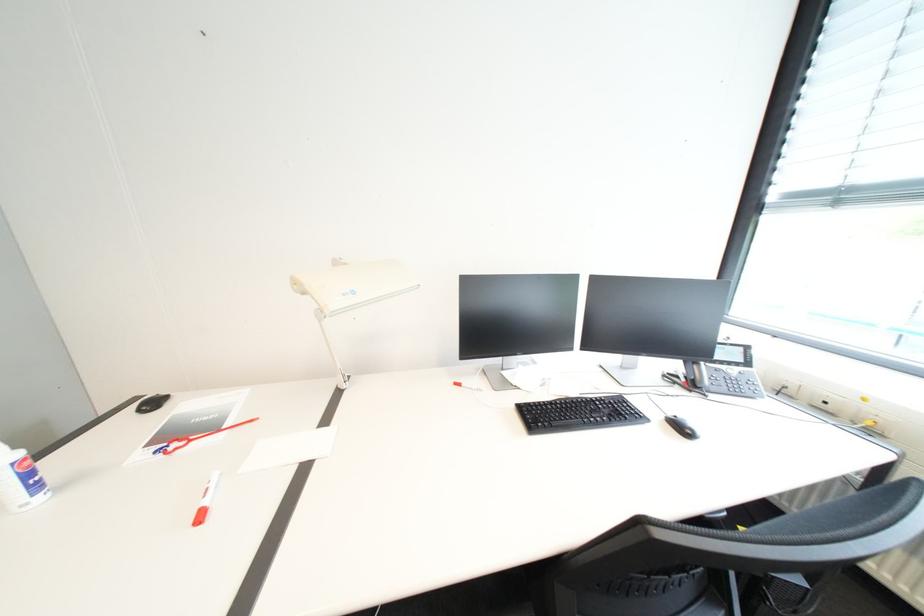
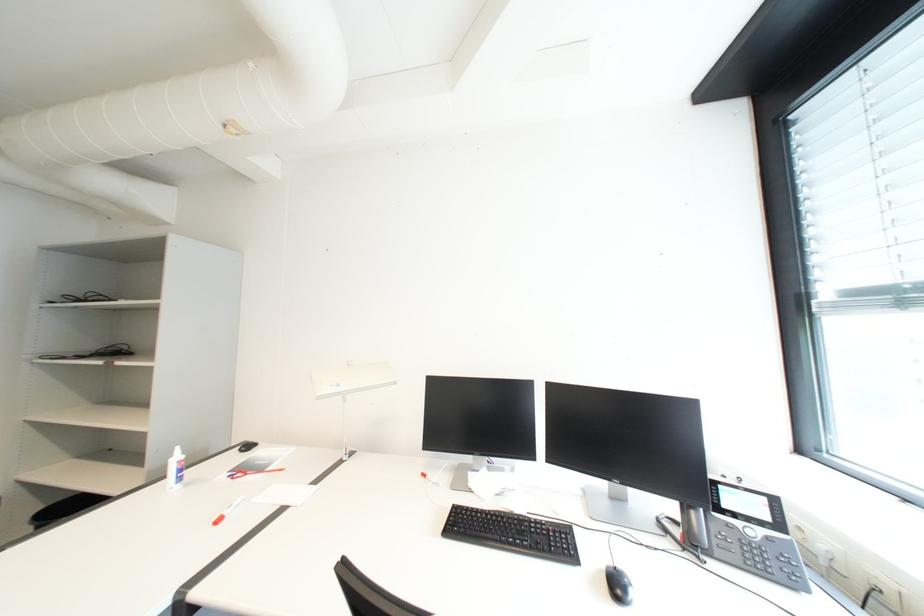
First-person continuous shooting, in which direction is the camera rotating?

The rotation direction of the camera is left-up.